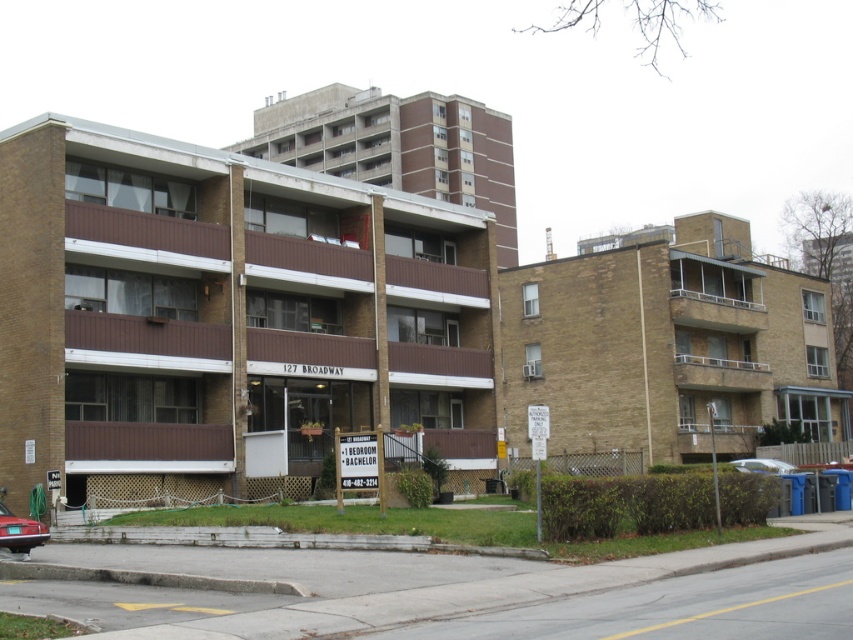
Which of these two, shiny red sedan at lower left or white glossy sedan at lower right, stands shorter?

shiny red sedan at lower left is shorter.

Does point (18, 529) come behind point (753, 465)?

That is False.

This screenshot has height=640, width=853. Identify the location of shiny red sedan at lower left. (20, 532).